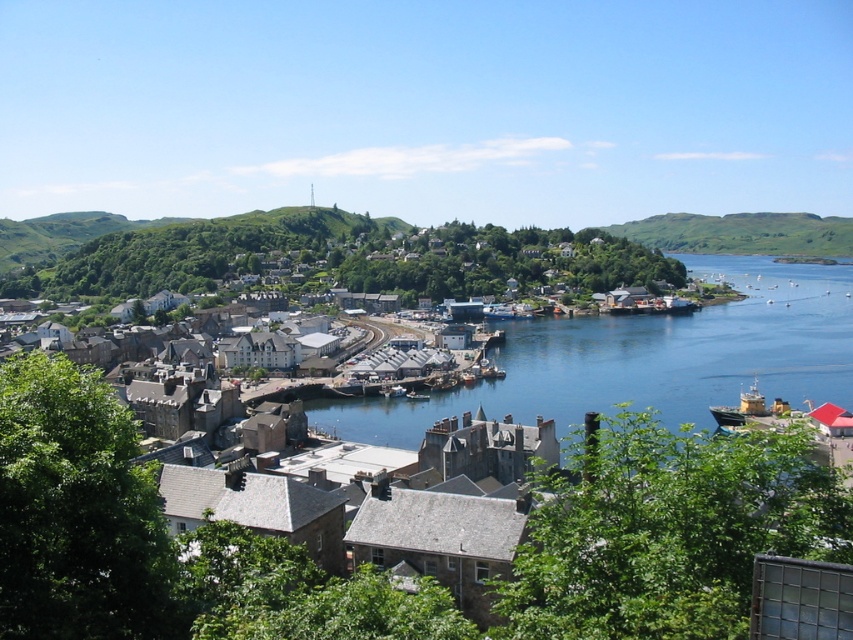
You are standing at the viewpoint overlooking the coastal town. You notice two green grassy hills in the distance. One is labeled as the green grassy hill at upper left and the other as the green grassy hill at right. Which hill would appear larger to you from your current position?

The green grassy hill at upper left appears larger because it is closer to the viewer than the green grassy hill at right.

You are standing at the viewpoint overlooking the coastal town. There are two points marked in the image. The first point is at coordinates point (535,349) and the second point is at coordinates point (688,250). If you were to walk towards both points, which one would you reach first?

Point (535,349) is closer to the viewer than point (688,250), so you would reach point (535,349) first.

You are standing at the viewpoint overlooking the coastal town. If you want to take a photo of the blue water at center, where should you aim your camera based on the 2D coordinates provided?

The blue water at center is located at the 2D coordinates point (648, 358), so you should aim your camera there to capture it.